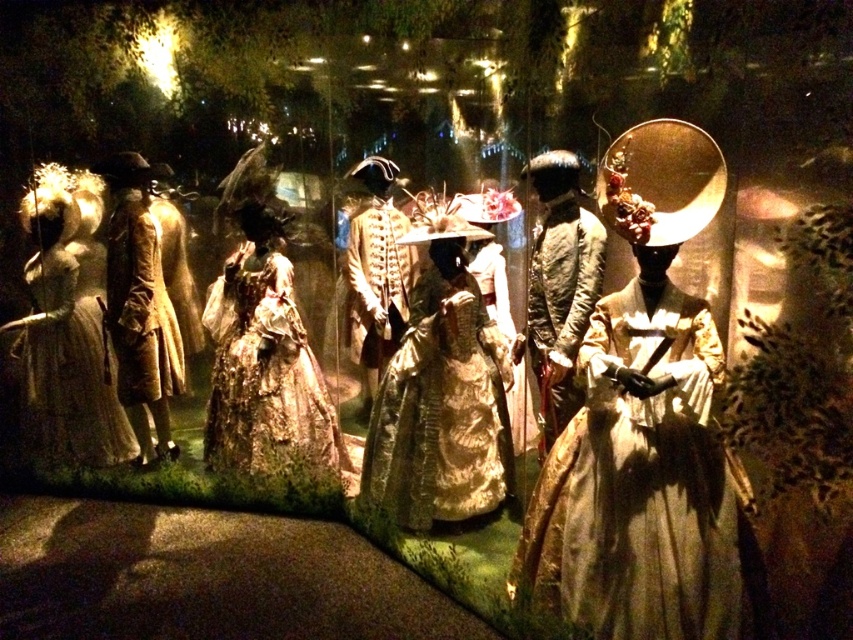
You are a museum curator who needs to rearrange the gold satin dress at center and the silvery metallic gown at left for a new exhibition. The museum requires that the distance between these two items must be exactly 8 feet. Can you achieve this without moving any other displayed items?

The current distance between the gold satin dress at center and the silvery metallic gown at left is 7.18 feet. To reach the required 8 feet, you would need to adjust their positions slightly while ensuring no other items are moved. This might involve shifting one or both of them in opposite directions along the display area to increase the distance by approximately 0.82 feet.

You are a museum visitor standing in front of the display. You notice the gold satin dress at center and the silvery metallic gown at left. Which of these two items is placed lower in the display?

The gold satin dress at center is positioned under the silvery metallic gown at left, so it is placed lower in the display.

You are a museum curator planning to place a 1.2 meter wide display stand in the center of the room. You have two costumes to display, the gold satin dress at center and the silvery metallic gown at left. Which costume would require a wider stand to accommodate its width?

The silvery metallic gown at left requires a wider stand because its width is greater than the gold satin dress at center.